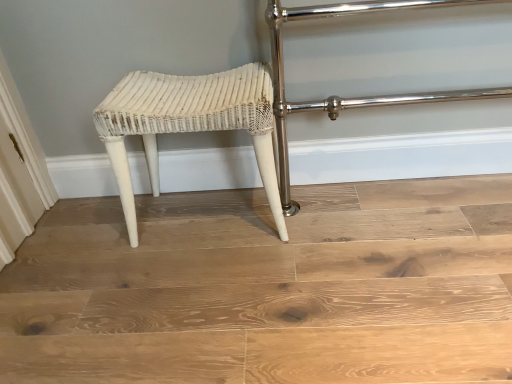
Identify the location of vacant space that is to the left of white wicker stool at center. This screenshot has height=384, width=512. (95, 240).